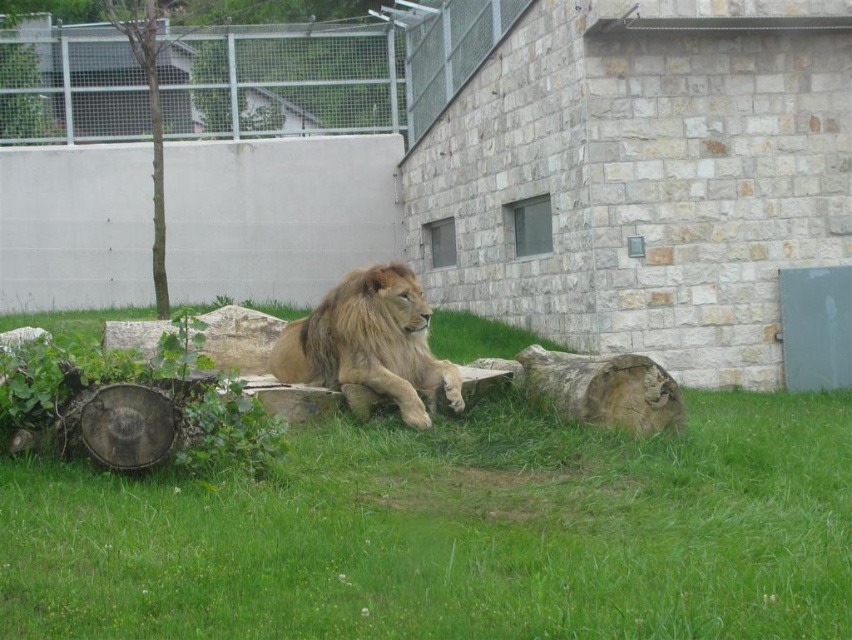
You are a zookeeper who needs to clean the area around the golden fur lion at center and the green bark tree at upper left. Based on their positions, which object is closer to the front of the enclosure?

The golden fur lion at center is closer to the front of the enclosure because it is in front of the green bark tree at upper left.